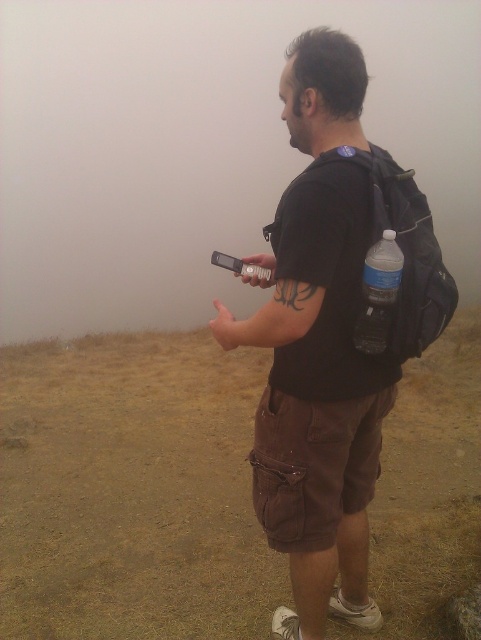
Looking at this image, you are trying to take a photo of the man in the foggy environment. Since the black matte shirt at center and the black fabric backpack at upper right are both dark, will the backpack be visible behind the shirt in the photo?

The black matte shirt at center is in front of the black fabric backpack at upper right, so the backpack will not be visible behind the shirt in the photo because they are both black and the shirt is covering the backpack.

You are a photographer trying to take a photo of the foggy landscape. You have a black fabric backpack at upper right and a brushed metal camera at upper center. Which object is covering the other one?

The black fabric backpack at upper right is positioned over the brushed metal camera at upper center, so the backpack is covering the camera.

You are a photographer trying to capture the man in the scene. Since the foggy atmosphere at upper center is at a specific coordinate, will you need to adjust your camera focus to ensure the man is clear?

The foggy atmosphere at upper center is located at point (x=201, y=147), so you need to focus on the man who is in front of that point to ensure he is clear.